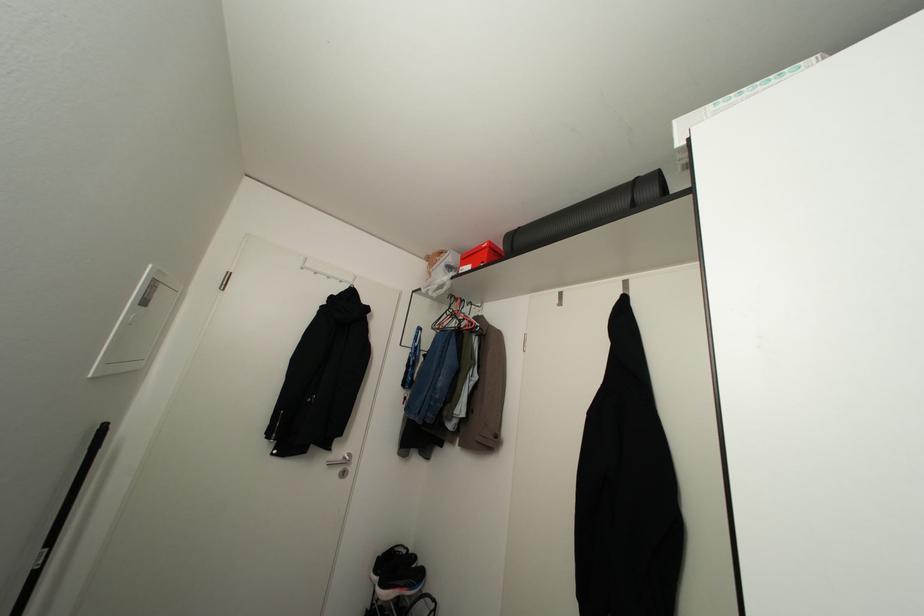
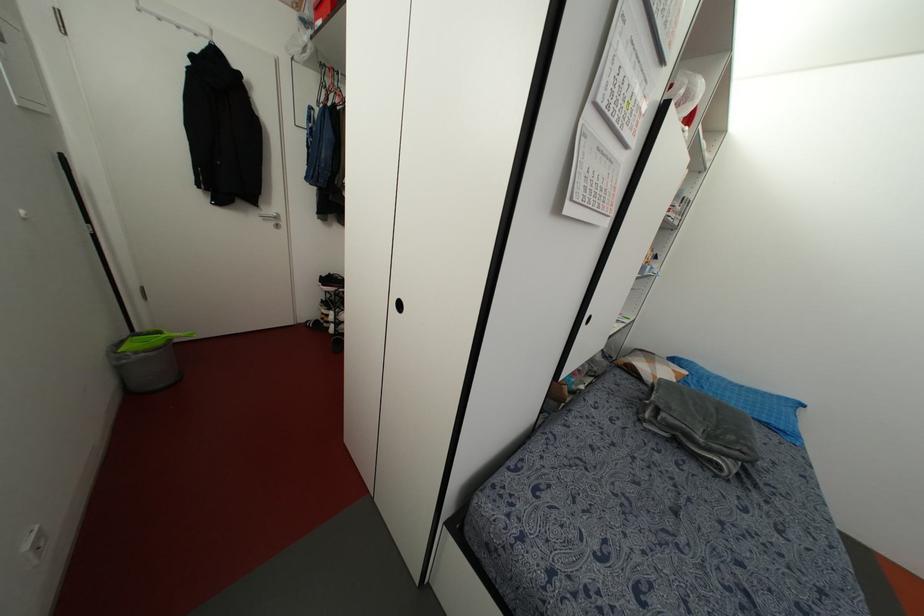
In the second image, find the point that corresponds to the point at 460,264 in the first image.

(315, 18)